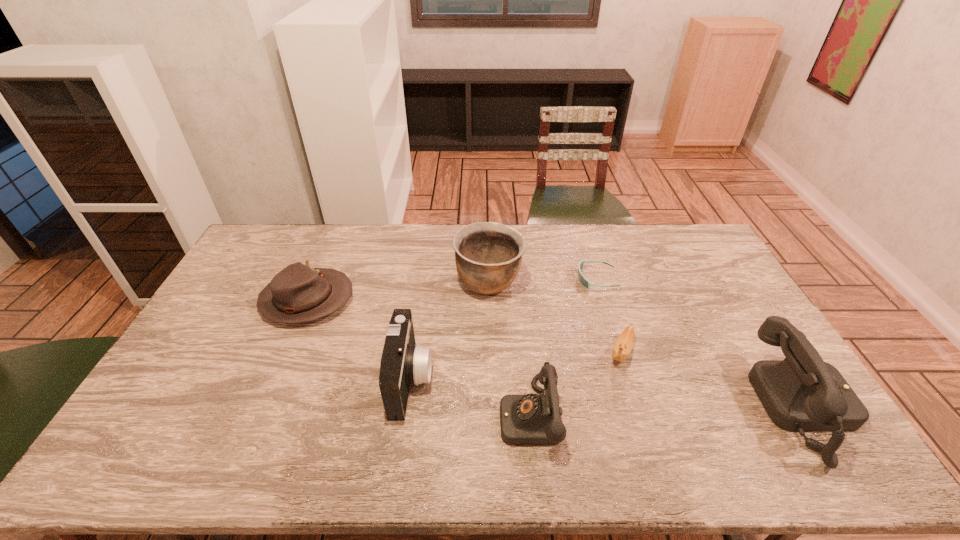
You are a GUI agent. You are given a task and a screenshot of the screen. Output one action in this format:
    pyautogui.click(x=<x>, y=<y>)
    Task: Click on the fourth closest object to the third shortest object
    This screenshot has height=540, width=960.
    Given the screenshot: What is the action you would take?
    pyautogui.click(x=583, y=281)

Where is `object that stands as the fifth closest to the goggles`? object that stands as the fifth closest to the goggles is located at coordinates (403, 363).

Image resolution: width=960 pixels, height=540 pixels. Find the location of `vacant space that satisfies the following two spatial constraints: 1. on the decorative side of the leftmost object; 2. on the back side of the sixth tallest object`. vacant space that satisfies the following two spatial constraints: 1. on the decorative side of the leftmost object; 2. on the back side of the sixth tallest object is located at coordinates point(285,352).

Locate an element on the screen. Image resolution: width=960 pixels, height=540 pixels. vacant space that satisfies the following two spatial constraints: 1. on the front-facing side of the shortest object; 2. on the left side of the sixth tallest object is located at coordinates (619, 352).

This screenshot has width=960, height=540. What are the coordinates of `vacant space that satisfies the following two spatial constraints: 1. on the decorative side of the third shortest object; 2. on the right side of the banana` in the screenshot? It's located at (285, 352).